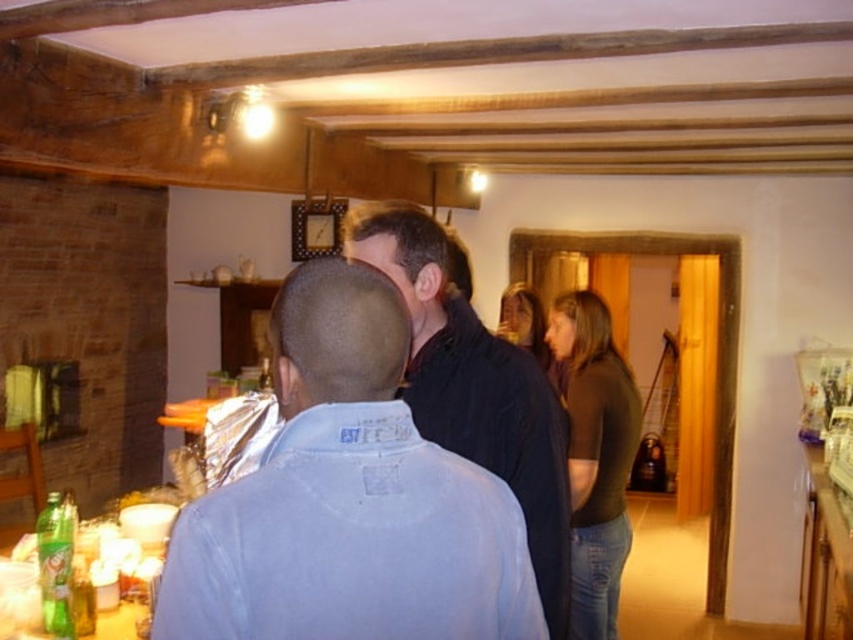
You are organizing a small event and need to place a decorative item on the table. The table has limited space. Given the black matte jacket at center and the green glass bottle at lower left, which object should you avoid placing near the edge to prevent it from falling off?

The black matte jacket at center has a larger width than the green glass bottle at lower left, so it has a wider base and is less likely to fall off the edge. Therefore, you should avoid placing the green glass bottle at lower left near the edge since it has a narrower base and is more prone to tipping over.

You are standing in the room and want to determine which of the two points, point (527, 451) or point (67, 609), is nearer to you. Based on the scene description, which point is closer?

Point (527, 451) is closer to the camera than point (67, 609), so it is the closer one.